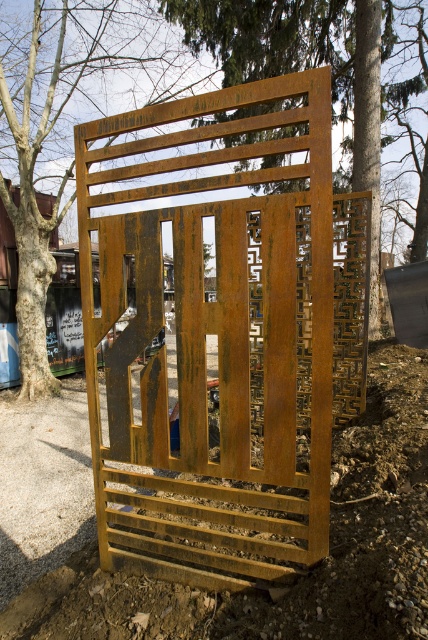
Question: Among these objects, which one is nearest to the camera?

Choices:
 (A) rusty metal gate at center
 (B) rusty metal tree at center
 (C) rusty metal fence at center

Answer: (A)

Question: Is rusty metal gate at center positioned at the back of rusty metal tree at center?

Choices:
 (A) yes
 (B) no

Answer: (B)

Question: Considering the real-world distances, which object is farthest from the rusty metal tree at center?

Choices:
 (A) rusty metal fence at center
 (B) rusty metal gate at center

Answer: (B)

Question: Which of the following is the farthest from the observer?

Choices:
 (A) rusty metal tree at center
 (B) rusty metal gate at center

Answer: (A)

Question: Does rusty metal gate at center appear over rusty metal tree at center?

Choices:
 (A) yes
 (B) no

Answer: (B)

Question: Does rusty metal tree at center have a greater width compared to rusty metal fence at center?

Choices:
 (A) no
 (B) yes

Answer: (A)